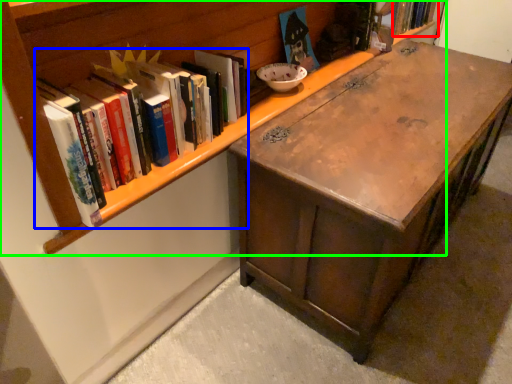
Question: Which object is the farthest from book (highlighted by a red box)? Choose among these: book (highlighted by a blue box) or bookcase (highlighted by a green box).

Choices:
 (A) book
 (B) bookcase

Answer: (A)